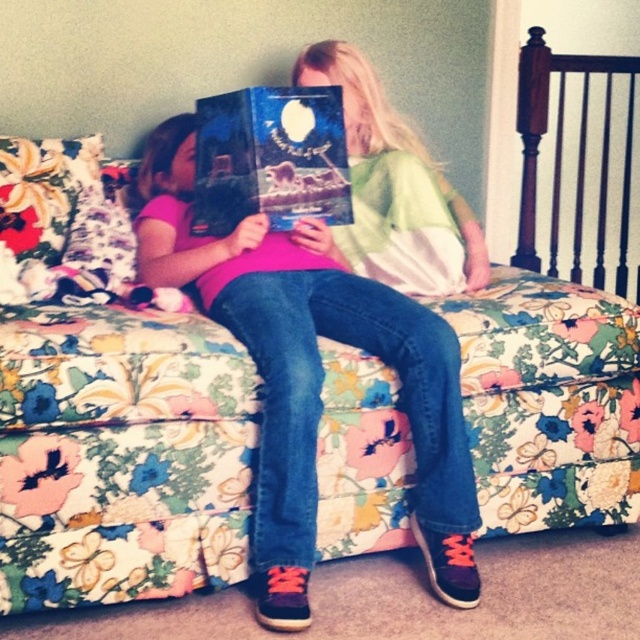
You are standing in the room and want to place a small plant between the two points marked as point (259, 353) and point (333, 212). Which point should the plant be closer to in order to be positioned between them?

The plant should be closer to point (333, 212) because point (259, 353) is in front of point (333, 212), meaning the latter is further back. Placing the plant closer to the point that is further back ensures it is between them.